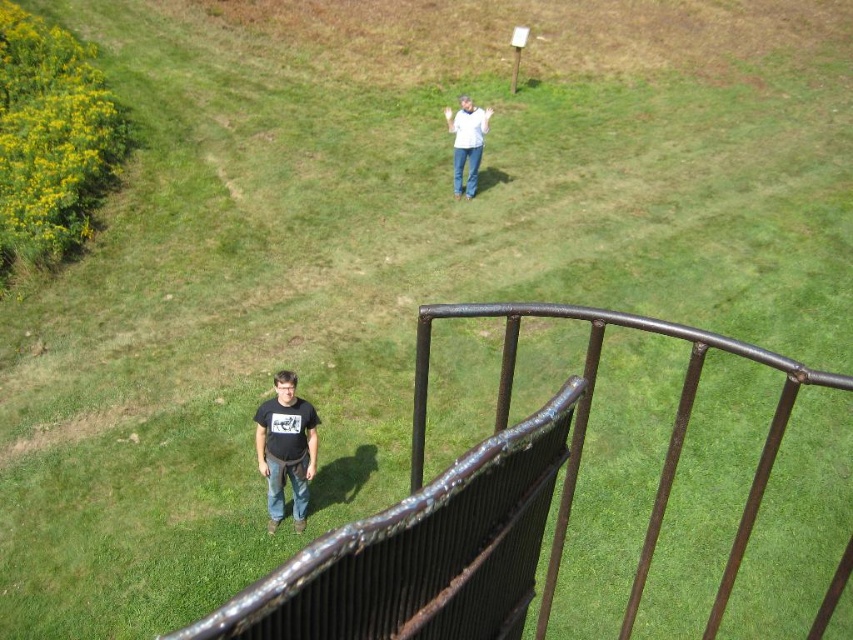
Question: Which object is positioned closest to the blue denim jeans at lower center?

Choices:
 (A) denim at center
 (B) rusty metal fence at lower right
 (C) white matte shirt at upper center

Answer: (B)

Question: Which point appears farthest from the camera in this image?

Choices:
 (A) (474, 156)
 (B) (421, 486)
 (C) (465, 138)
 (D) (305, 442)

Answer: (A)

Question: Is black matte t-shirt at lower center to the right of white matte shirt at upper center from the viewer's perspective?

Choices:
 (A) no
 (B) yes

Answer: (A)

Question: From the image, what is the correct spatial relationship of black matte t-shirt at lower center in relation to denim at center?

Choices:
 (A) right
 (B) left

Answer: (B)

Question: Based on their relative distances, which object is nearer to the denim at center?

Choices:
 (A) rusty metal fence at lower right
 (B) black matte t-shirt at lower center
 (C) blue denim jeans at lower center

Answer: (C)

Question: Is black matte t-shirt at lower center bigger than white matte shirt at upper center?

Choices:
 (A) no
 (B) yes

Answer: (A)